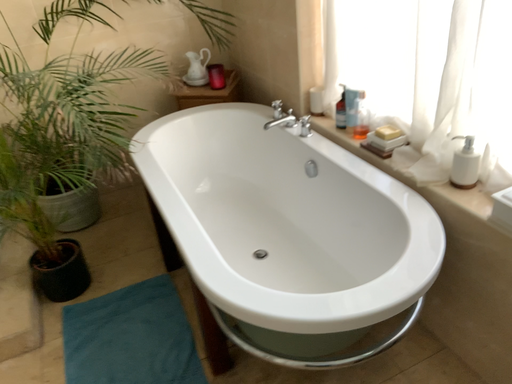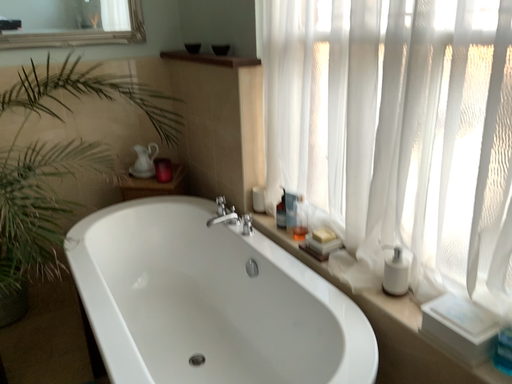
Question: Which way did the camera rotate in the video?

Choices:
 (A) rotated upward
 (B) rotated downward

Answer: (A)